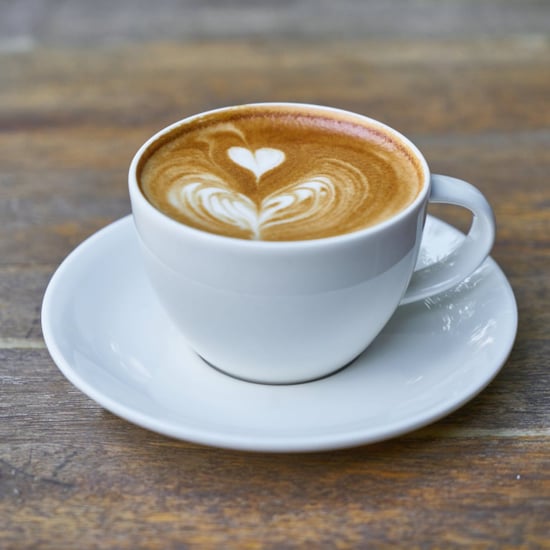
The image size is (550, 550). Identify the location of rim of cup. (327, 241).